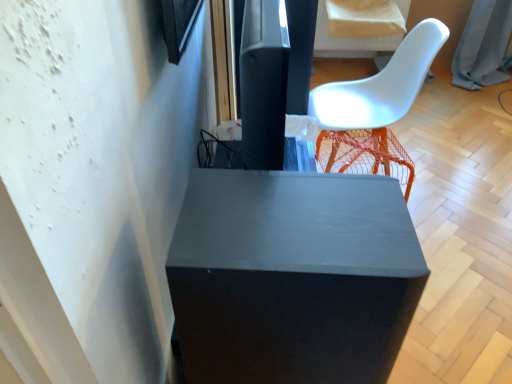
Question: Is orange mesh stool at right aimed at matte black speaker at upper center?

Choices:
 (A) no
 (B) yes

Answer: (A)

Question: Does orange mesh stool at right come behind matte black speaker at upper center?

Choices:
 (A) yes
 (B) no

Answer: (B)

Question: From a real-world perspective, is orange mesh stool at right on matte black speaker at upper center?

Choices:
 (A) yes
 (B) no

Answer: (B)

Question: Does orange mesh stool at right have a lesser height compared to matte black speaker at upper center?

Choices:
 (A) yes
 (B) no

Answer: (A)

Question: From the image's perspective, is orange mesh stool at right under matte black speaker at upper center?

Choices:
 (A) no
 (B) yes

Answer: (B)

Question: From the image's perspective, is white plastic chair at upper right positioned above or below matte black cube at center?

Choices:
 (A) above
 (B) below

Answer: (A)

Question: Looking at their shapes, would you say white plastic chair at upper right is wider or thinner than matte black cube at center?

Choices:
 (A) thin
 (B) wide

Answer: (B)

Question: From a real-world perspective, relative to matte black cube at center, is white plastic chair at upper right vertically above or below?

Choices:
 (A) above
 (B) below

Answer: (B)

Question: From their relative heights in the image, would you say white plastic chair at upper right is taller or shorter than matte black cube at center?

Choices:
 (A) short
 (B) tall

Answer: (B)

Question: In terms of size, does matte black cube at center appear bigger or smaller than white plastic chair at upper right?

Choices:
 (A) big
 (B) small

Answer: (B)

Question: Based on their positions, is matte black cube at center located to the left or right of white plastic chair at upper right?

Choices:
 (A) left
 (B) right

Answer: (A)

Question: From the image's perspective, is matte black cube at center above or below white plastic chair at upper right?

Choices:
 (A) below
 (B) above

Answer: (A)

Question: Looking at their shapes, would you say matte black cube at center is wider or thinner than white plastic chair at upper right?

Choices:
 (A) thin
 (B) wide

Answer: (A)

Question: From a real-world perspective, is matte black cube at center positioned above or below orange mesh stool at right?

Choices:
 (A) above
 (B) below

Answer: (A)

Question: From their relative heights in the image, would you say matte black cube at center is taller or shorter than orange mesh stool at right?

Choices:
 (A) tall
 (B) short

Answer: (A)